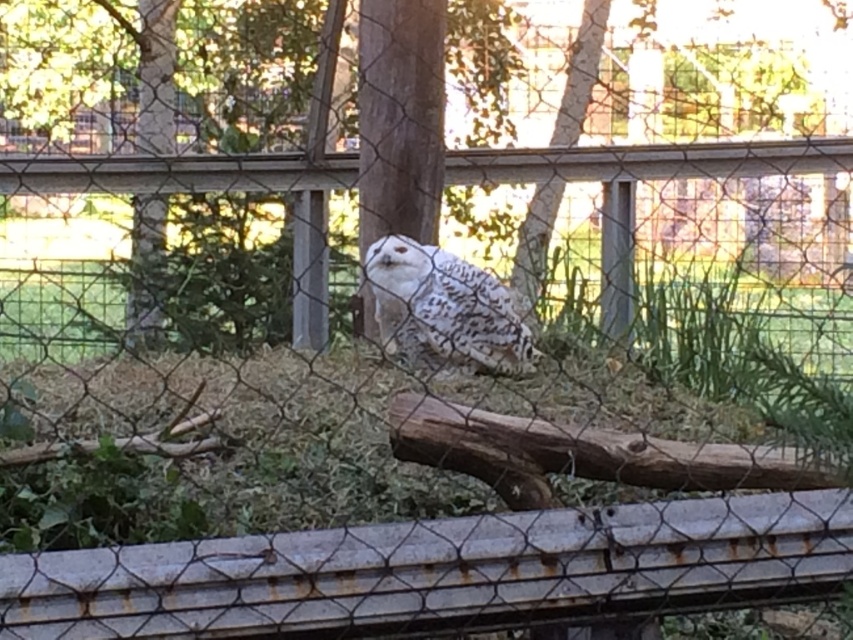
Question: Does rusty metal rail at lower center appear under white speckled owl at center?

Choices:
 (A) yes
 (B) no

Answer: (A)

Question: Can you confirm if rusty metal rail at lower center is wider than white speckled owl at center?

Choices:
 (A) yes
 (B) no

Answer: (A)

Question: Among these points, which one is nearest to the camera?

Choices:
 (A) (390, 241)
 (B) (386, 540)

Answer: (B)

Question: Among these points, which one is nearest to the camera?

Choices:
 (A) (500, 362)
 (B) (450, 576)

Answer: (B)

Question: From the image, what is the correct spatial relationship of rusty metal rail at lower center in relation to white speckled owl at center?

Choices:
 (A) above
 (B) below

Answer: (B)